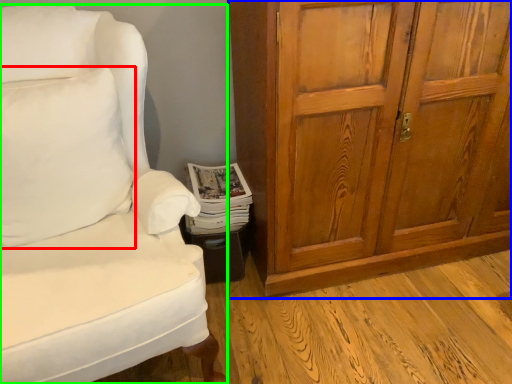
Question: Which object is the farthest from pillow (highlighted by a red box)? Choose among these: cabinetry (highlighted by a blue box) or chair (highlighted by a green box).

Choices:
 (A) cabinetry
 (B) chair

Answer: (A)